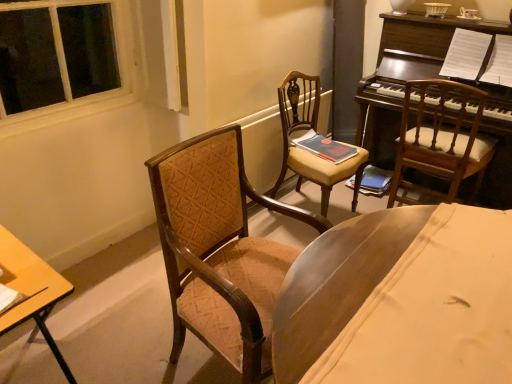
Question: From their relative heights in the image, would you say hardcover book at center, positioned as the 2th book in front-to-back order, is taller or shorter than matte red book at center, the 2th book when ordered from right to left?

Choices:
 (A) tall
 (B) short

Answer: (A)

Question: From the image's perspective, is hardcover book at center, the second book when ordered from left to right, located above or below matte red book at center, the first book positioned from the front?

Choices:
 (A) below
 (B) above

Answer: (A)

Question: Which object is the farthest from the hardcover book at center, positioned as the 2th book in front-to-back order?

Choices:
 (A) wooden chair at right, the first chair from the right
 (B) matte red book at center, marked as the 1th book in a left-to-right arrangement
 (C) wooden desk at lower left
 (D) velvet brown armchair at center, the third chair when ordered from right to left
 (E) matte brown wooden chair at center, which is the second chair from left to right

Answer: (C)

Question: Based on their relative distances, which object is nearer to the hardcover book at center, the 1th book positioned from the right?

Choices:
 (A) wooden desk at lower left
 (B) matte red book at center, the 2th book when ordered from right to left
 (C) dark brown polished wood piano at upper right
 (D) velvet brown armchair at center, positioned as the 1th chair in left-to-right order
 (E) wooden chair at right, the first chair from the right

Answer: (E)